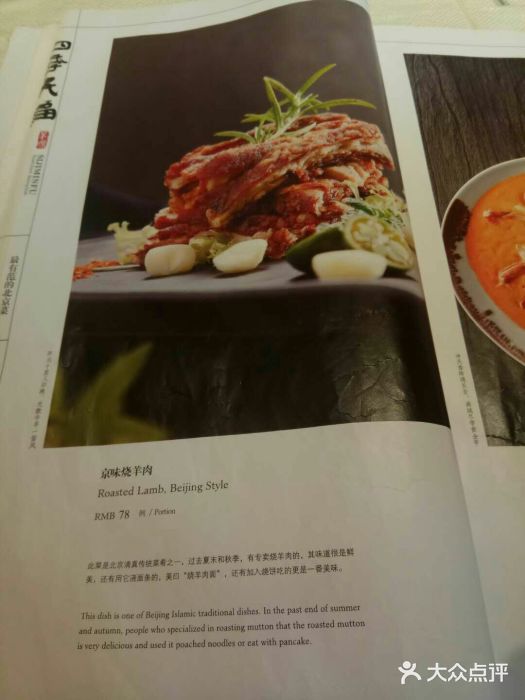
You are a GUI agent. You are given a task and a screenshot of the screen. Output one action in this format:
    pyautogui.click(x=<x>, y=<y>)
    Task: Click on the red pattern on bowl rim
    
    Given the screenshot: What is the action you would take?
    pyautogui.click(x=451, y=220)